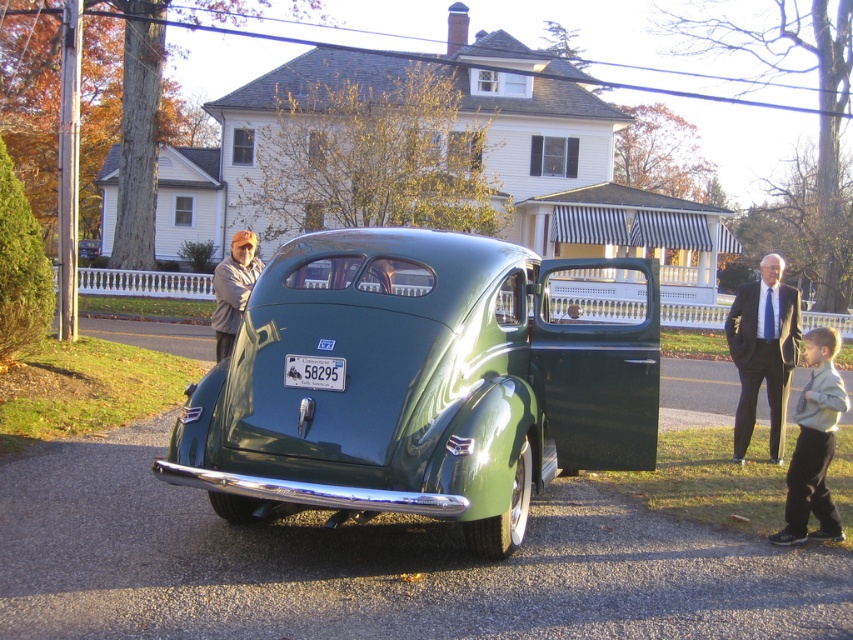
Question: Which object is the farthest from the shiny green car at center?

Choices:
 (A) light gray sweater at lower right
 (B) gray wool jacket at left
 (C) dark gray suit at right

Answer: (B)

Question: Is gray wool jacket at left smaller than white plastic license plate at center?

Choices:
 (A) no
 (B) yes

Answer: (A)

Question: Does dark gray suit at right appear on the left side of light gray sweater at lower right?

Choices:
 (A) yes
 (B) no

Answer: (B)

Question: Which of these objects is positioned closest to the shiny green car at center?

Choices:
 (A) dark gray suit at right
 (B) gray wool jacket at left
 (C) white plastic license plate at center
 (D) light gray sweater at lower right

Answer: (C)

Question: Which object is the closest to the gray wool jacket at left?

Choices:
 (A) dark gray suit at right
 (B) light gray sweater at lower right
 (C) shiny green car at center
 (D) white plastic license plate at center

Answer: (D)

Question: Is dark gray suit at right further to the viewer compared to white plastic license plate at center?

Choices:
 (A) yes
 (B) no

Answer: (A)